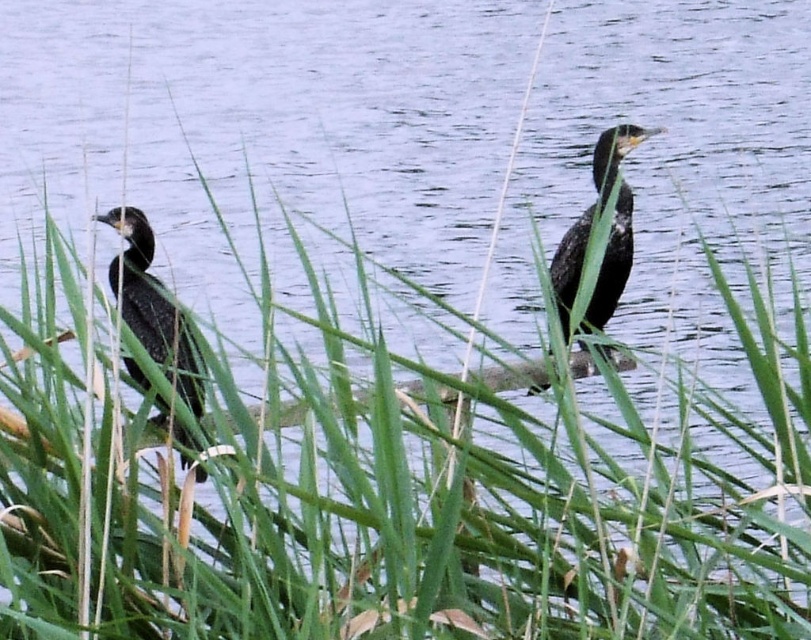
You are a birdwatcher observing two shiny black birds in a natural setting. You see the shiny black bird at left and the shiny black bird at center. Which one is positioned more to the left side of the scene?

The shiny black bird at left is positioned more to the left side of the scene compared to the shiny black bird at center.

You are a birdwatcher standing in front of the reeds and want to observe both shiny black birds. Which bird, the shiny black bird at left or the shiny black bird at center, is easier to see because it is closer to you?

The shiny black bird at left is closer to the viewer, so it is easier to see than the shiny black bird at center.